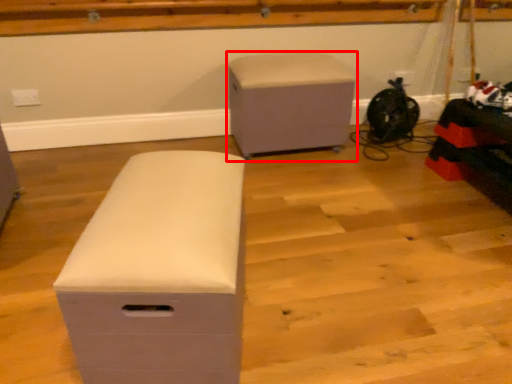
Question: From the image's perspective, considering the relative positions of furniture (annotated by the red box) and furniture in the image provided, where is furniture (annotated by the red box) located with respect to the staircase?

Choices:
 (A) below
 (B) above

Answer: (B)